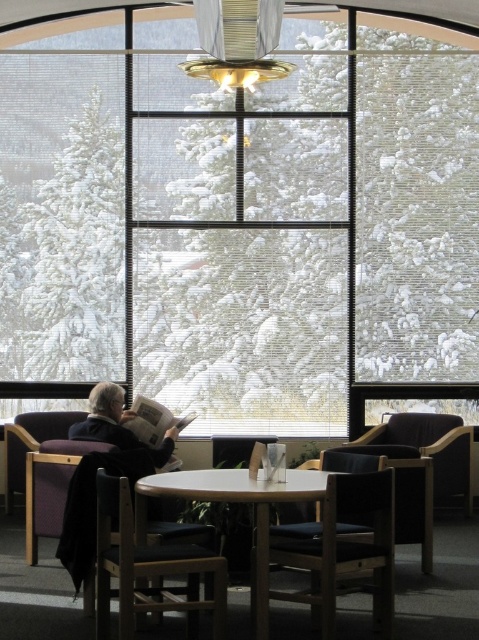
You are a guest at a winter gathering and need to choose between the dark wood chair at lower center and the dark brown leather armchair at lower right. Which chair is taller?

The dark wood chair at lower center is taller than the dark brown leather armchair at lower right.